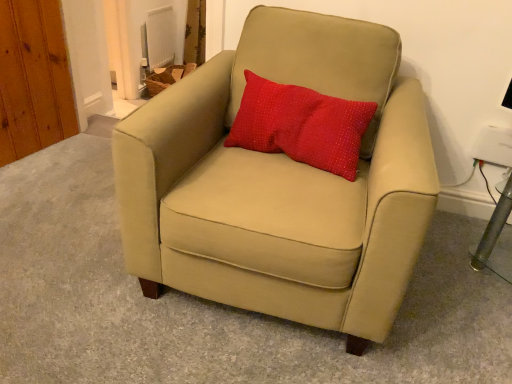
Question: Considering the relative positions of suede beige armchair at center and red dotted fabric pillow at center in the image provided, is suede beige armchair at center to the right of red dotted fabric pillow at center from the viewer's perspective?

Choices:
 (A) yes
 (B) no

Answer: (B)

Question: Does suede beige armchair at center have a smaller size compared to red dotted fabric pillow at center?

Choices:
 (A) no
 (B) yes

Answer: (A)

Question: From the image's perspective, is suede beige armchair at center on top of red dotted fabric pillow at center?

Choices:
 (A) no
 (B) yes

Answer: (A)

Question: Can you confirm if suede beige armchair at center is bigger than red dotted fabric pillow at center?

Choices:
 (A) yes
 (B) no

Answer: (A)

Question: Considering the relative positions of suede beige armchair at center and red dotted fabric pillow at center in the image provided, is suede beige armchair at center in front of red dotted fabric pillow at center?

Choices:
 (A) yes
 (B) no

Answer: (A)

Question: Is there a large distance between suede beige armchair at center and red dotted fabric pillow at center?

Choices:
 (A) yes
 (B) no

Answer: (B)

Question: Does red dotted fabric pillow at center have a lesser width compared to suede beige armchair at center?

Choices:
 (A) no
 (B) yes

Answer: (B)

Question: Can you confirm if red dotted fabric pillow at center is shorter than suede beige armchair at center?

Choices:
 (A) yes
 (B) no

Answer: (A)

Question: Can you confirm if red dotted fabric pillow at center is bigger than suede beige armchair at center?

Choices:
 (A) yes
 (B) no

Answer: (B)

Question: From the image's perspective, is red dotted fabric pillow at center under suede beige armchair at center?

Choices:
 (A) no
 (B) yes

Answer: (A)

Question: Can you confirm if red dotted fabric pillow at center is wider than suede beige armchair at center?

Choices:
 (A) no
 (B) yes

Answer: (A)

Question: From a real-world perspective, is red dotted fabric pillow at center positioned under suede beige armchair at center based on gravity?

Choices:
 (A) no
 (B) yes

Answer: (A)

Question: Based on their sizes in the image, would you say suede beige armchair at center is bigger or smaller than red dotted fabric pillow at center?

Choices:
 (A) small
 (B) big

Answer: (B)